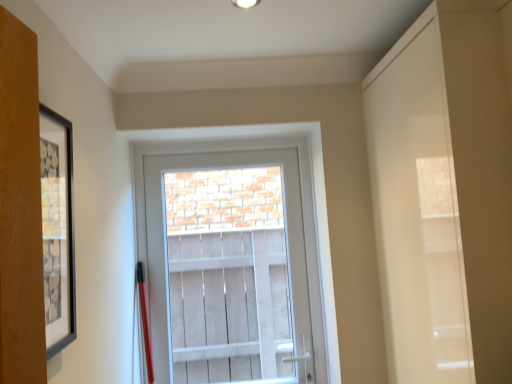
Question: Considering the relative positions of clear glass door at center and black matte picture frame at left in the image provided, is clear glass door at center to the left or to the right of black matte picture frame at left?

Choices:
 (A) left
 (B) right

Answer: (B)

Question: From the image's perspective, is clear glass door at center positioned above or below black matte picture frame at left?

Choices:
 (A) above
 (B) below

Answer: (B)

Question: Based on their relative distances, which object is nearer to the white glossy door at right?

Choices:
 (A) clear glass door at center
 (B) black matte picture frame at left

Answer: (B)

Question: Estimate the real-world distances between objects in this image. Which object is farther from the white glossy door at right?

Choices:
 (A) clear glass door at center
 (B) black matte picture frame at left

Answer: (A)